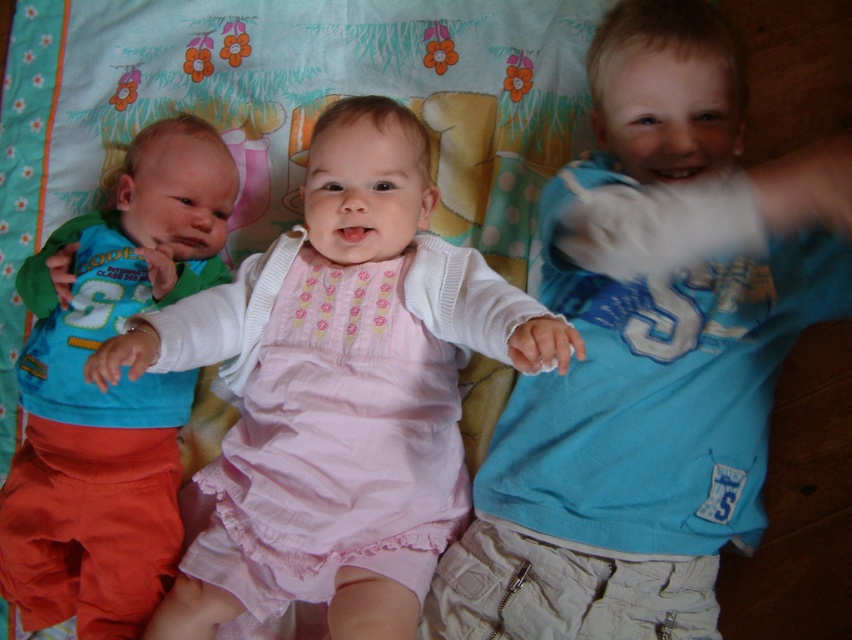
You are a photographer trying to capture a photo of the children on the blanket. You need to adjust your camera to focus on both the blue cotton shirt at center and the matte blue shirt at left. Which shirt should you focus on first to ensure proper focus due to their sizes?

The blue cotton shirt at center has a greater height compared to the matte blue shirt at left, so you should focus on the blue cotton shirt at center first because it is larger and requires more precise focus.